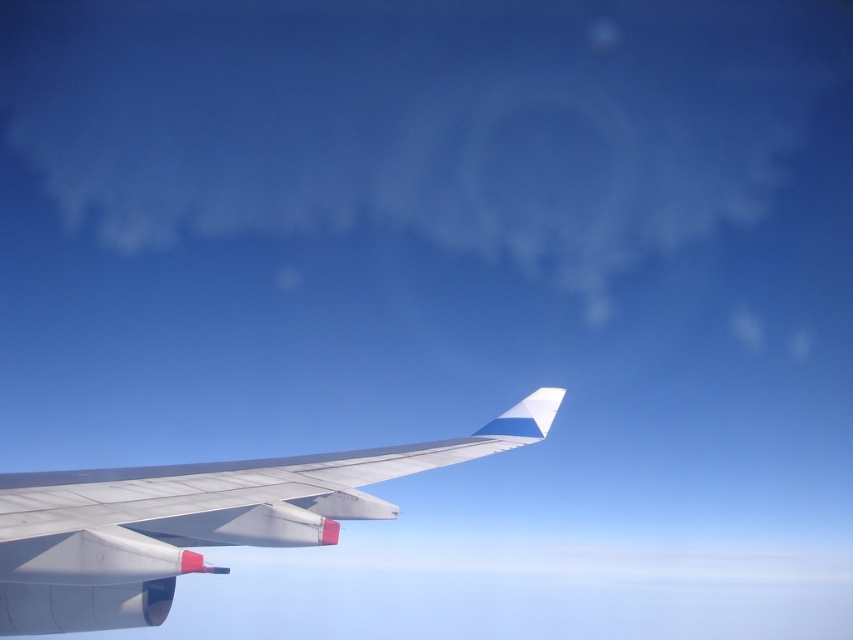
Question: Which point is farther to the camera?

Choices:
 (A) (189, 36)
 (B) (525, 433)

Answer: (A)

Question: Among these objects, which one is farthest from the camera?

Choices:
 (A) white fluffy cloud at upper center
 (B) metallic gray wing at center

Answer: (A)

Question: Which object is farther from the camera taking this photo?

Choices:
 (A) white fluffy cloud at upper center
 (B) metallic gray wing at center

Answer: (A)

Question: Is white fluffy cloud at upper center thinner than metallic gray wing at center?

Choices:
 (A) yes
 (B) no

Answer: (B)

Question: Does white fluffy cloud at upper center appear on the left side of metallic gray wing at center?

Choices:
 (A) yes
 (B) no

Answer: (A)

Question: Is white fluffy cloud at upper center wider than metallic gray wing at center?

Choices:
 (A) yes
 (B) no

Answer: (A)